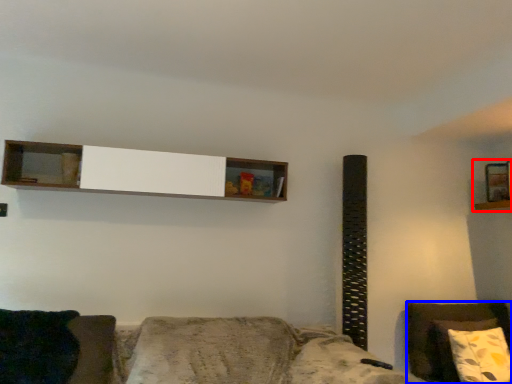
Question: Among these objects, which one is farthest to the camera, shelf (highlighted by a red box) or furniture (highlighted by a blue box)?

Choices:
 (A) shelf
 (B) furniture

Answer: (A)